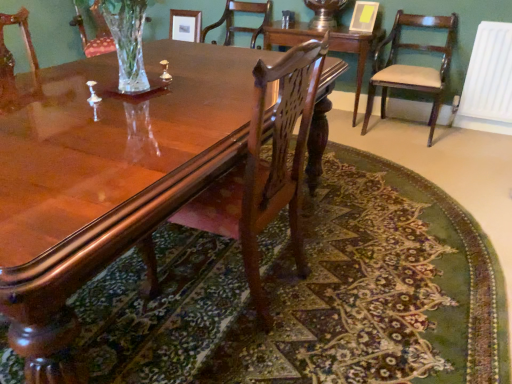
Find the location of a particular element. Image resolution: width=512 pixels, height=384 pixels. vacant location below mahogany wood chair at right, placed as the first chair when sorted from right to left (from a real-world perspective) is located at coordinates (399, 132).